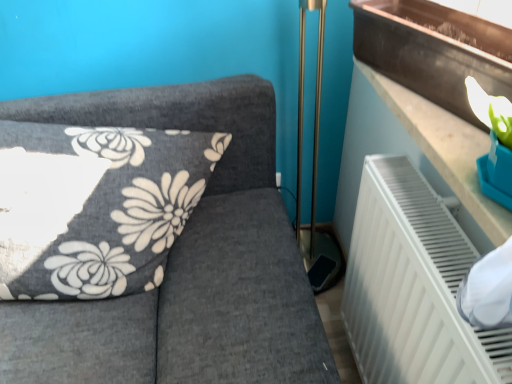
Question: From a real-world perspective, relative to dark gray fabric cushion at upper left, is metallic brown window sill at upper right vertically above or below?

Choices:
 (A) above
 (B) below

Answer: (A)

Question: In terms of size, does metallic brown window sill at upper right appear bigger or smaller than dark gray fabric cushion at upper left?

Choices:
 (A) big
 (B) small

Answer: (B)

Question: From the image's perspective, is metallic brown window sill at upper right located above or below dark gray fabric cushion at upper left?

Choices:
 (A) below
 (B) above

Answer: (B)

Question: From the image's perspective, is dark gray fabric cushion at upper left above or below metallic brown window sill at upper right?

Choices:
 (A) below
 (B) above

Answer: (A)

Question: From a real-world perspective, is dark gray fabric cushion at upper left positioned above or below metallic brown window sill at upper right?

Choices:
 (A) above
 (B) below

Answer: (B)

Question: Do you think dark gray fabric cushion at upper left is within metallic brown window sill at upper right, or outside of it?

Choices:
 (A) outside
 (B) inside

Answer: (A)

Question: From their relative heights in the image, would you say dark gray fabric cushion at upper left is taller or shorter than metallic brown window sill at upper right?

Choices:
 (A) short
 (B) tall

Answer: (B)